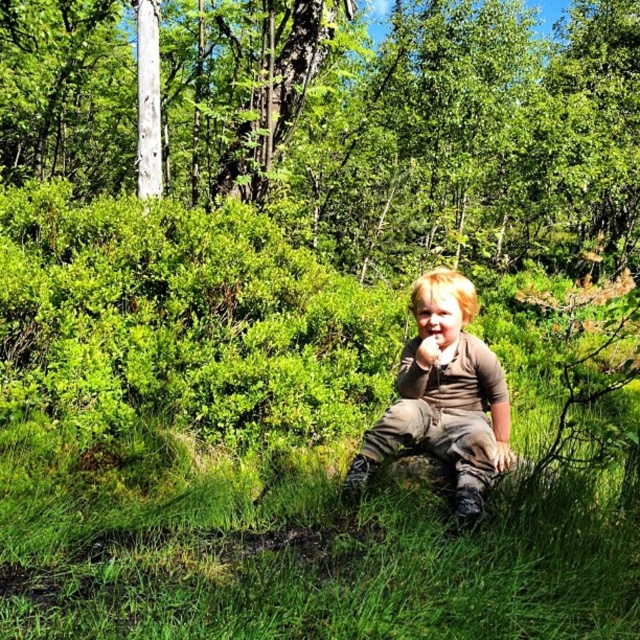
Question: Which point is closer to the camera?

Choices:
 (A) (451, 272)
 (B) (16, 104)

Answer: (A)

Question: Which point is farther to the camera?

Choices:
 (A) brown textured shirt at center
 (B) green leafy tree at upper center

Answer: (B)

Question: Is green leafy tree at upper center thinner than brown textured shirt at center?

Choices:
 (A) yes
 (B) no

Answer: (B)

Question: From the image, what is the correct spatial relationship of green leafy tree at upper center in relation to brown textured shirt at center?

Choices:
 (A) left
 (B) right

Answer: (B)

Question: Is green leafy tree at upper center to the left of brown textured shirt at center from the viewer's perspective?

Choices:
 (A) yes
 (B) no

Answer: (B)